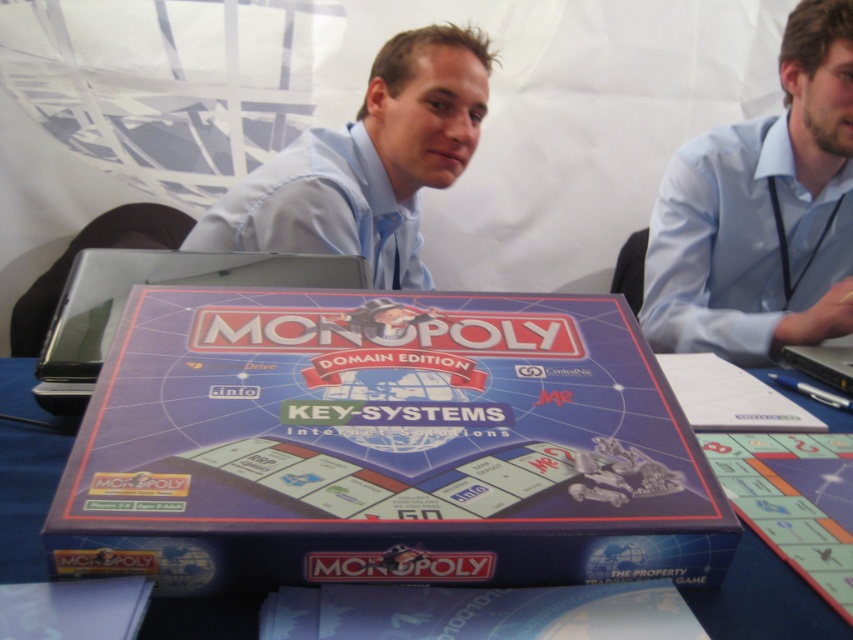
Which is above, blue cardboard monopoly box at center or silver metallic laptop at center?

silver metallic laptop at center

Does blue cardboard monopoly box at center appear on the left side of silver metallic laptop at center?

No, blue cardboard monopoly box at center is not to the left of silver metallic laptop at center.

Is point (822, 628) positioned after point (135, 250)?

No.

Find the location of a particular element. blue cardboard monopoly box at center is located at coordinates (763, 600).

Can you confirm if light blue shirt at center is positioned to the left of silver metallic laptop at center?

In fact, light blue shirt at center is to the right of silver metallic laptop at center.

Does light blue shirt at center appear under silver metallic laptop at center?

Incorrect, light blue shirt at center is not positioned below silver metallic laptop at center.

Locate an element on the screen. light blue shirt at center is located at coordinates (367, 163).

Locate an element on the screen. light blue shirt at center is located at coordinates (367, 163).

Can you confirm if blue shirt at upper right is taller than silver metallic laptop at center?

Yes, blue shirt at upper right is taller than silver metallic laptop at center.

Who is positioned more to the right, blue shirt at upper right or silver metallic laptop at center?

From the viewer's perspective, blue shirt at upper right appears more on the right side.

Does point (817, 340) come behind point (68, 275)?

No, it is in front of (68, 275).

At what (x,y) coordinates should I click in order to perform the action: click on blue shirt at upper right. Please return your answer as a coordinate pair (x, y). The image size is (853, 640). Looking at the image, I should click on (762, 212).